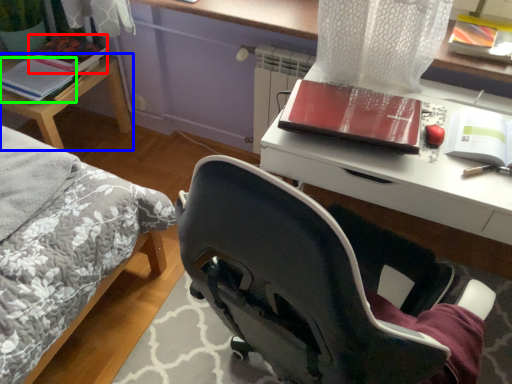
Question: Which is nearer to the paperback book (highlighted by a red box)? table (highlighted by a blue box) or paperback book (highlighted by a green box).

Choices:
 (A) table
 (B) paperback book

Answer: (B)